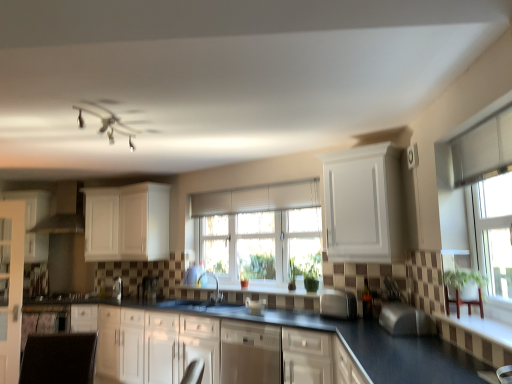
In order to face satin black coffee machine at center, should I rotate leftwards or rightwards?

Turn left approximately 13.901 degrees to face it.

Measure the distance between point (x=463, y=186) and camera.

The depth of point (x=463, y=186) is 2.42 meters.

What is the approximate width of white pleated blinds at center?

The width of white pleated blinds at center is 3.12 inches.

This screenshot has width=512, height=384. What do you see at coordinates (257, 198) in the screenshot? I see `white pleated blinds at center` at bounding box center [257, 198].

What is the approximate width of white glass window at center, marked as the first window in a back-to-front arrangement?

It is 3.32 inches.

In order to face satin nickel faucet at center, should I rotate leftwards or rightwards?

A 5.952 degree turn to the left will do.

This screenshot has width=512, height=384. What are the coordinates of `satin black coffee machine at center` in the screenshot? It's located at (149, 288).

Does white pleated blinds at center turn towards white glass window at center, marked as the first window in a back-to-front arrangement?

No, white pleated blinds at center does not turn towards white glass window at center, marked as the first window in a back-to-front arrangement.

Where is `curtain that is in front of the white glass window at center, which is the second window in front-to-back order`? The image size is (512, 384). curtain that is in front of the white glass window at center, which is the second window in front-to-back order is located at coordinates (257, 198).

Does white pleated blinds at center appear on the left side of white glass window at center, which is the second window in front-to-back order?

Indeed, white pleated blinds at center is positioned on the left side of white glass window at center, which is the second window in front-to-back order.

Is white glass window at center, acting as the first window starting from the left, completely or partially inside white pleated blinds at center?

No, white glass window at center, acting as the first window starting from the left, is not a part of white pleated blinds at center.

Can you confirm if white glossy cabinets at center, which is the 2th cabinetry from right to left, is thinner than white fabric armchair at lower right?

No, white glossy cabinets at center, which is the 2th cabinetry from right to left, is not thinner than white fabric armchair at lower right.

Does white glossy cabinets at center, which is the 2th cabinetry from right to left, touch white fabric armchair at lower right?

There is a gap between white glossy cabinets at center, which is the 2th cabinetry from right to left, and white fabric armchair at lower right.

Between white glossy cabinets at center, which is the 2th cabinetry from right to left, and white fabric armchair at lower right, which one has smaller size?

white fabric armchair at lower right is smaller.

From a real-world perspective, is white glossy cabinets at center, which is the 2th cabinetry from right to left, under white fabric armchair at lower right?

Indeed, from a real-world perspective, white glossy cabinets at center, which is the 2th cabinetry from right to left, is positioned beneath white fabric armchair at lower right.

Is white glossy cabinets at center, the 4th cabinetry when ordered from left to right, completely or partially outside of white matte cabinet at center, the 3th cabinetry from the right?

Yes.

Is white glossy cabinets at center, which is the 2th cabinetry from right to left, facing towards white matte cabinet at center, the 3th cabinetry when ordered from left to right?

No, white glossy cabinets at center, which is the 2th cabinetry from right to left, does not turn towards white matte cabinet at center, the 3th cabinetry when ordered from left to right.

From a real-world perspective, between white glossy cabinets at center, the 4th cabinetry when ordered from left to right, and white matte cabinet at center, the 3th cabinetry from the right, who is vertically lower?

white glossy cabinets at center, the 4th cabinetry when ordered from left to right, is physically lower.

Can you confirm if satin silver toaster at center, the first appliance positioned from the bottom, is shorter than matte white exhaust hood at left?

Correct, satin silver toaster at center, the first appliance positioned from the bottom, is not as tall as matte white exhaust hood at left.

From the image's perspective, between satin silver toaster at center, the first appliance positioned from the bottom, and matte white exhaust hood at left, who is located below?

satin silver toaster at center, the first appliance positioned from the bottom.

From the picture: Can you tell me how much satin silver toaster at center, placed as the second appliance when sorted from right to left, and matte white exhaust hood at left differ in facing direction?

There is a 26.1-degree angle between the facing directions of satin silver toaster at center, placed as the second appliance when sorted from right to left, and matte white exhaust hood at left.

Is satin silver toaster at center, positioned as the first appliance in back-to-front order, inside or outside of matte white exhaust hood at left?

satin silver toaster at center, positioned as the first appliance in back-to-front order, is located beyond the bounds of matte white exhaust hood at left.

Between satin silver toaster at center, the 2th appliance when ordered from front to back, and clear glass door at left, which one appears on the right side from the viewer's perspective?

Positioned to the right is satin silver toaster at center, the 2th appliance when ordered from front to back.

Consider the image. Which object is more forward, satin silver toaster at center, the first appliance positioned from the bottom, or clear glass door at left?

clear glass door at left is in front.

In the scene shown: Can you confirm if satin silver toaster at center, which is counted as the first appliance, starting from the left, is smaller than clear glass door at left?

Yes.

Is satin black coffee machine at center surrounded by white pleated blinds at center?

No, white pleated blinds at center does not contain satin black coffee machine at center.

The height and width of the screenshot is (384, 512). Identify the location of curtain to the right of satin black coffee machine at center. (257, 198).

From a real-world perspective, which is physically below, white pleated blinds at center or satin black coffee machine at center?

satin black coffee machine at center, from a real-world perspective.

From the picture: What's the angular difference between white pleated blinds at center and satin black coffee machine at center's facing directions?

They differ by 2.42 degrees in their facing directions.

Looking at this image, can white matte cabinet at upper left, marked as the 4th cabinetry in a right-to-left arrangement, be found inside white fabric armchair at lower right?

No, white matte cabinet at upper left, marked as the 4th cabinetry in a right-to-left arrangement, is not surrounded by white fabric armchair at lower right.

In the scene shown: Who is more distant, white fabric armchair at lower right or white matte cabinet at upper left, arranged as the 2th cabinetry when viewed from the left?

white matte cabinet at upper left, arranged as the 2th cabinetry when viewed from the left.

Can you confirm if white fabric armchair at lower right is bigger than white matte cabinet at upper left, marked as the 4th cabinetry in a right-to-left arrangement?

No.

Is white fabric armchair at lower right oriented towards white matte cabinet at upper left, arranged as the 2th cabinetry when viewed from the left?

No, white fabric armchair at lower right is not facing towards white matte cabinet at upper left, arranged as the 2th cabinetry when viewed from the left.

In order to click on curtain on the left of white glass window at center, marked as the first window in a back-to-front arrangement in this screenshot , I will do `click(257, 198)`.

In the image, there is a white fabric armchair at lower right. Where is `cabinetry below it (from a real-world perspective)`? This screenshot has width=512, height=384. cabinetry below it (from a real-world perspective) is located at coordinates (221, 350).

Estimate the real-world distances between objects in this image. Which object is further from matte white exhaust hood at left, silver metallic toaster at center, the first appliance from the right, or satin black gas stove at lower left?

silver metallic toaster at center, the first appliance from the right, lies further to matte white exhaust hood at left than the other object.

Estimate the real-world distances between objects in this image. Which object is closer to white pleated blinds at center, clear glass door at left or white fabric armchair at lower right?

clear glass door at left is positioned closer to the anchor white pleated blinds at center.

Which object lies further to the anchor point white matte cabinet at upper center, the 5th cabinetry viewed from the left, satin black gas stove at lower left or silver metallic toaster at center, marked as the 1th appliance in a front-to-back arrangement?

satin black gas stove at lower left.

Which object lies nearer to the anchor point satin black coffee machine at center, white matte cabinet at upper center, the 5th cabinetry viewed from the left, or white glossy cabinets at center, which is the 2th cabinetry from right to left?

Among the two, white glossy cabinets at center, which is the 2th cabinetry from right to left, is located nearer to satin black coffee machine at center.

From the image, which object appears to be nearer to satin silver toaster at center, positioned as the first appliance in back-to-front order, white glass window at center, which is counted as the second window, starting from the right, or satin black coffee machine at center?

satin black coffee machine at center is positioned closer to the anchor satin silver toaster at center, positioned as the first appliance in back-to-front order.

From the image, which object appears to be nearer to white glossy cabinet at left, the 5th cabinetry from the right, silver metallic toaster at center, the first appliance from the right, or satin black coffee machine at center?

satin black coffee machine at center is positioned closer to the anchor white glossy cabinet at left, the 5th cabinetry from the right.

When comparing their distances from white glossy cabinets at center, the 4th cabinetry when ordered from left to right, does white matte cabinet at center, the 3th cabinetry when ordered from left to right, or white matte cabinet at upper center, the 5th cabinetry viewed from the left, seem further?

Among the two, white matte cabinet at center, the 3th cabinetry when ordered from left to right, is located further to white glossy cabinets at center, the 4th cabinetry when ordered from left to right.

When comparing their distances from silver metallic toaster at center, marked as the 1th appliance in a front-to-back arrangement, does satin black coffee machine at center or satin black gas stove at lower left seem further?

satin black gas stove at lower left lies further to silver metallic toaster at center, marked as the 1th appliance in a front-to-back arrangement, than the other object.

In order to click on exhaust hood between white glossy cabinet at left, the 5th cabinetry from the right, and white matte cabinet at upper left, marked as the 4th cabinetry in a right-to-left arrangement, in the horizontal direction in this screenshot , I will do `click(64, 211)`.

Locate an element on the screen. window between white glossy cabinets at center, which is the 2th cabinetry from right to left, and silver metallic toaster at center, placed as the 2th appliance when sorted from bottom to top is located at coordinates (259, 230).

The width and height of the screenshot is (512, 384). What are the coordinates of `screen door situated between white glossy cabinet at left, the 5th cabinetry from the right, and clear glass window at upper right, which is counted as the 2th window, starting from the left, from left to right` in the screenshot? It's located at (12, 290).

Identify the location of tap located between white fabric armchair at lower right and white glossy cabinet at left, the 1th cabinetry in the left-to-right sequence, in the depth direction. The width and height of the screenshot is (512, 384). (216, 285).